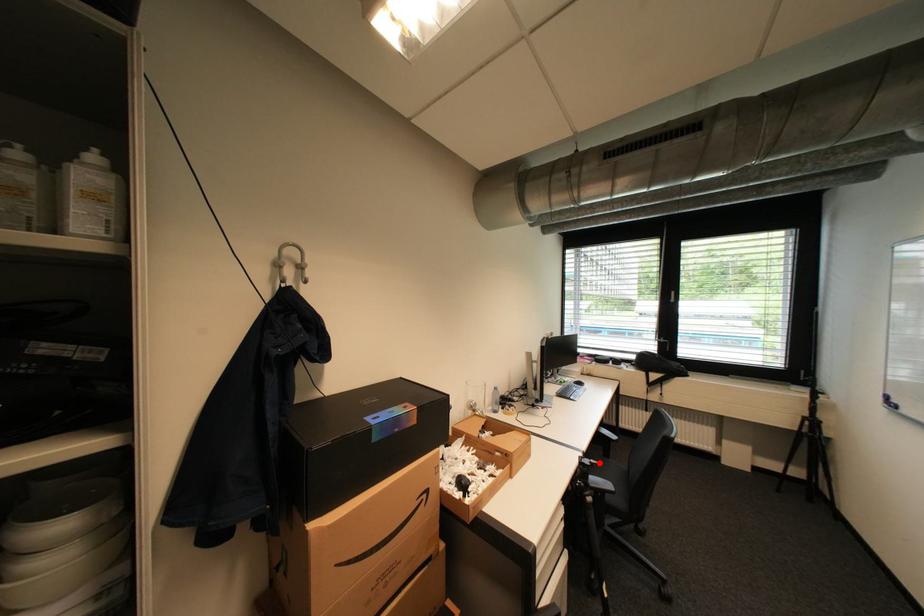
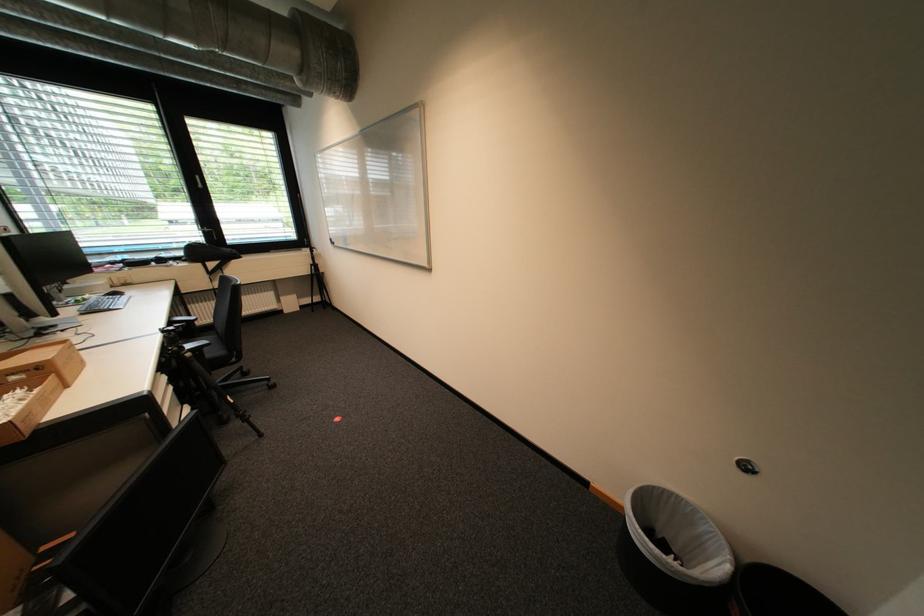
Question: I am providing you with two images of the same scene from different viewpoints. A red point is shown in image1. For the corresponding object point in image2, is it positioned nearer or farther from the camera?

Choices:
 (A) Nearer
 (B) Farther

Answer: (A)